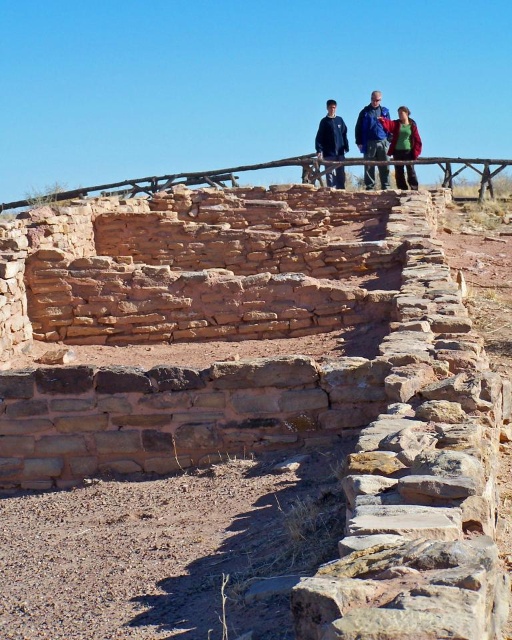
Which is below, blue denim jacket at upper center or dark blue jacket at upper center?

dark blue jacket at upper center is below.

Is the position of blue denim jacket at upper center more distant than that of dark blue jacket at upper center?

Yes, blue denim jacket at upper center is further from the viewer.

Locate an element on the screen. The image size is (512, 640). blue denim jacket at upper center is located at coordinates (372, 129).

In the scene shown: Does brown wooden rail at upper center appear over green matte jacket at upper center?

Indeed, brown wooden rail at upper center is positioned over green matte jacket at upper center.

Between brown wooden rail at upper center and green matte jacket at upper center, which one is positioned lower?

green matte jacket at upper center

At what (x,y) coordinates should I click in order to perform the action: click on brown wooden rail at upper center. Please return your answer as a coordinate pair (x, y). Looking at the image, I should click on (168, 182).

The image size is (512, 640). What do you see at coordinates (401, 134) in the screenshot?
I see `green matte jacket at upper center` at bounding box center [401, 134].

Can you confirm if green matte jacket at upper center is thinner than dark blue jacket at upper center?

Yes, green matte jacket at upper center is thinner than dark blue jacket at upper center.

Who is more distant from viewer, (408, 156) or (325, 147)?

The point (325, 147) is behind.

Find the location of a particular element. This screenshot has width=512, height=640. green matte jacket at upper center is located at coordinates (401, 134).